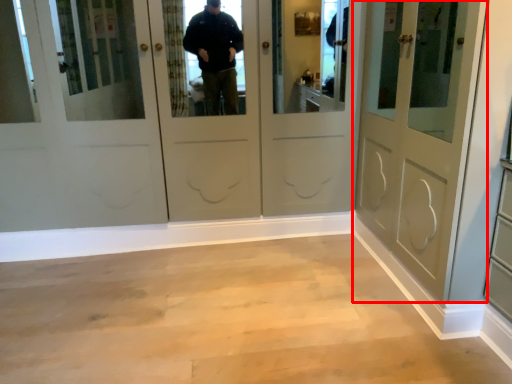
Question: From the image, what is the correct spatial relationship of door (annotated by the red box) in relation to corridor?

Choices:
 (A) right
 (B) left

Answer: (A)